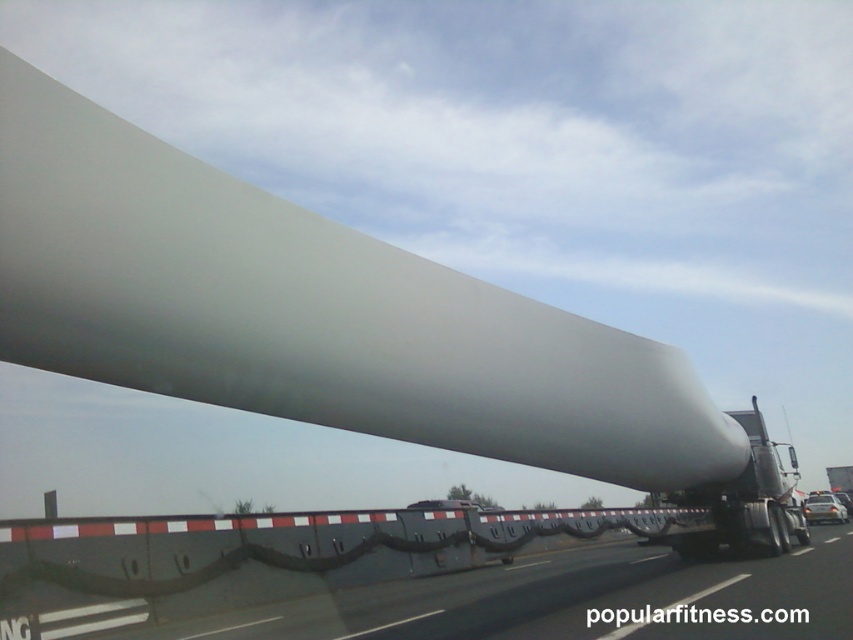
Question: Which point appears closest to the camera in this image?

Choices:
 (A) (264, 595)
 (B) (780, 547)

Answer: (A)

Question: Does black rubber barrier at center have a lesser width compared to white matte wind turbine blade at right?

Choices:
 (A) no
 (B) yes

Answer: (B)

Question: Is black rubber barrier at center behind white matte wind turbine blade at right?

Choices:
 (A) no
 (B) yes

Answer: (A)

Question: Does black rubber barrier at center appear over white matte wind turbine blade at right?

Choices:
 (A) no
 (B) yes

Answer: (B)

Question: Among these objects, which one is nearest to the camera?

Choices:
 (A) white matte wind turbine blade at right
 (B) black rubber barrier at center

Answer: (B)

Question: Which object appears farthest from the camera in this image?

Choices:
 (A) white matte wind turbine blade at right
 (B) black rubber barrier at center

Answer: (A)